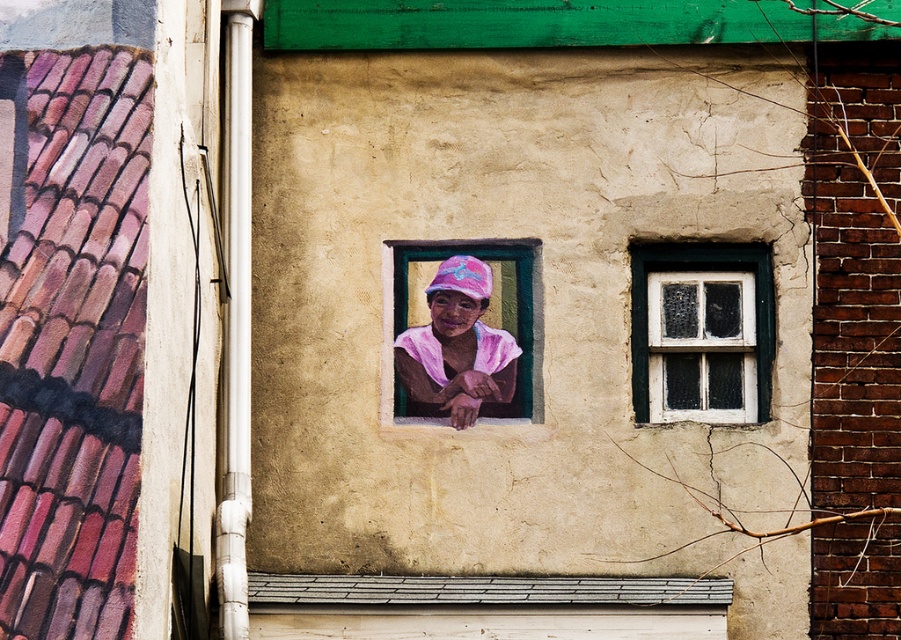
Question: Is white painted wood at upper right smaller than pink matte fabric at center?

Choices:
 (A) yes
 (B) no

Answer: (B)

Question: Can you confirm if pink fabric at center is positioned to the right of white painted wood at upper right?

Choices:
 (A) yes
 (B) no

Answer: (B)

Question: Which object is closer to the camera taking this photo?

Choices:
 (A) pink matte fabric at center
 (B) white painted wood at upper right

Answer: (B)

Question: Estimate the real-world distances between objects in this image. Which object is closer to the white painted wood at upper right?

Choices:
 (A) pink matte fabric at center
 (B) pink fabric at center

Answer: (B)

Question: Which point appears farthest from the camera in this image?

Choices:
 (A) (444, 273)
 (B) (733, 256)
 (C) (461, 320)

Answer: (A)

Question: Does pink fabric at center have a smaller size compared to white painted wood at upper right?

Choices:
 (A) yes
 (B) no

Answer: (A)